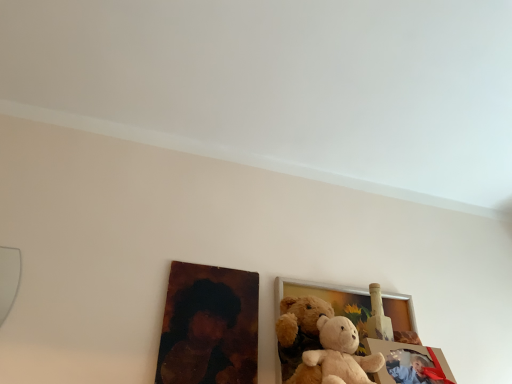
Question: Is matte plastic picture frame at lower right, acting as the 2th picture frame starting from the back, oriented towards oil painting portrait at lower left?

Choices:
 (A) yes
 (B) no

Answer: (B)

Question: Is there a large distance between matte plastic picture frame at lower right, acting as the 2th picture frame starting from the back, and oil painting portrait at lower left?

Choices:
 (A) yes
 (B) no

Answer: (B)

Question: Is oil painting portrait at lower left at the back of matte plastic picture frame at lower right, acting as the 2th picture frame starting from the back?

Choices:
 (A) yes
 (B) no

Answer: (B)

Question: From the image's perspective, is matte plastic picture frame at lower right, acting as the 2th picture frame starting from the back, on top of oil painting portrait at lower left?

Choices:
 (A) no
 (B) yes

Answer: (A)

Question: Is matte plastic picture frame at lower right, placed as the 1th picture frame when sorted from front to back, placed right next to oil painting portrait at lower left?

Choices:
 (A) no
 (B) yes

Answer: (A)

Question: In the image, is oil painting portrait at lower left on the left side or the right side of soft plush teddy bear at center?

Choices:
 (A) left
 (B) right

Answer: (A)

Question: Is oil painting portrait at lower left spatially inside soft plush teddy bear at center, or outside of it?

Choices:
 (A) outside
 (B) inside

Answer: (A)

Question: Looking at the image, does oil painting portrait at lower left seem bigger or smaller compared to soft plush teddy bear at center?

Choices:
 (A) big
 (B) small

Answer: (B)

Question: In the image, is oil painting portrait at lower left positioned in front of or behind soft plush teddy bear at center?

Choices:
 (A) front
 (B) behind

Answer: (B)

Question: In the image, is matte plastic picture frame at lower right, placed as the 1th picture frame when sorted from front to back, on the left side or the right side of soft plush teddy bear at center?

Choices:
 (A) right
 (B) left

Answer: (A)

Question: Is matte plastic picture frame at lower right, acting as the 2th picture frame starting from the back, taller or shorter than soft plush teddy bear at center?

Choices:
 (A) short
 (B) tall

Answer: (A)

Question: From a real-world perspective, relative to soft plush teddy bear at center, is matte plastic picture frame at lower right, placed as the 1th picture frame when sorted from front to back, vertically above or below?

Choices:
 (A) above
 (B) below

Answer: (B)

Question: Looking at the image, does matte plastic picture frame at lower right, placed as the 1th picture frame when sorted from front to back, seem bigger or smaller compared to soft plush teddy bear at center?

Choices:
 (A) big
 (B) small

Answer: (B)

Question: Does point (327, 301) appear closer or farther from the camera than point (214, 319)?

Choices:
 (A) farther
 (B) closer

Answer: (A)

Question: Choose the correct answer: Is wooden photo frame at center, which appears as the 2th picture frame when viewed from the front, inside oil painting portrait at lower left or outside it?

Choices:
 (A) outside
 (B) inside

Answer: (A)